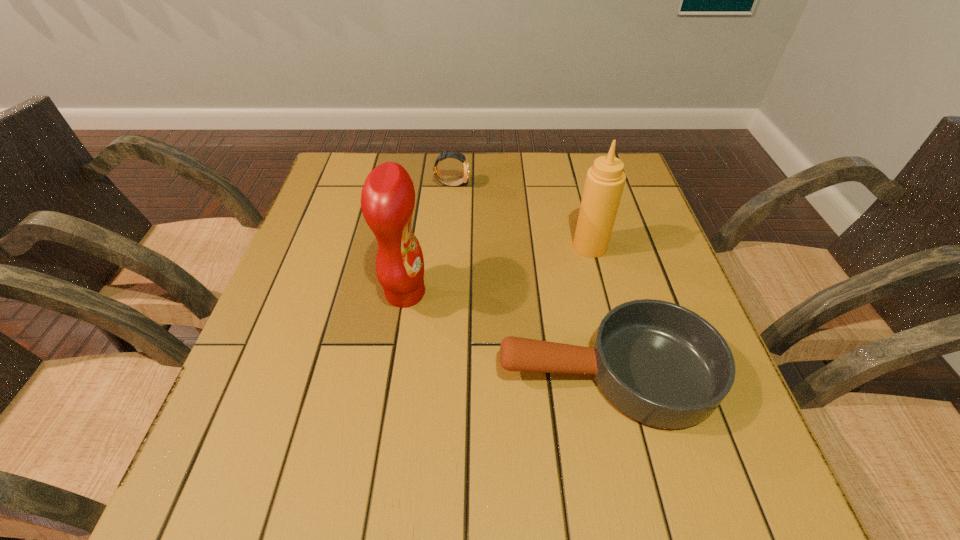
Image resolution: width=960 pixels, height=540 pixels. What are the coordinates of `the left condiment` in the screenshot? It's located at (388, 197).

Where is `the second nearest object`? The width and height of the screenshot is (960, 540). the second nearest object is located at coordinates [x=388, y=197].

Locate an element on the screen. This screenshot has width=960, height=540. the right condiment is located at coordinates (605, 180).

Identify the location of the farther condiment. This screenshot has height=540, width=960. (605, 180).

This screenshot has height=540, width=960. Find the location of `watch`. watch is located at coordinates (459, 156).

The image size is (960, 540). Find the location of `pan`. pan is located at coordinates (661, 364).

I want to click on the shortest object, so click(x=661, y=364).

I want to click on vacant space situated 0.210m on the label side of the second nearest object, so (523, 293).

The width and height of the screenshot is (960, 540). In order to click on free space located 0.110m on the back of the third nearest object in this screenshot , I will do `click(580, 208)`.

At what (x,y) coordinates should I click in order to perform the action: click on vacant area situated on the face of the farthest object. Please return your answer as a coordinate pair (x, y). Looking at the image, I should click on (497, 184).